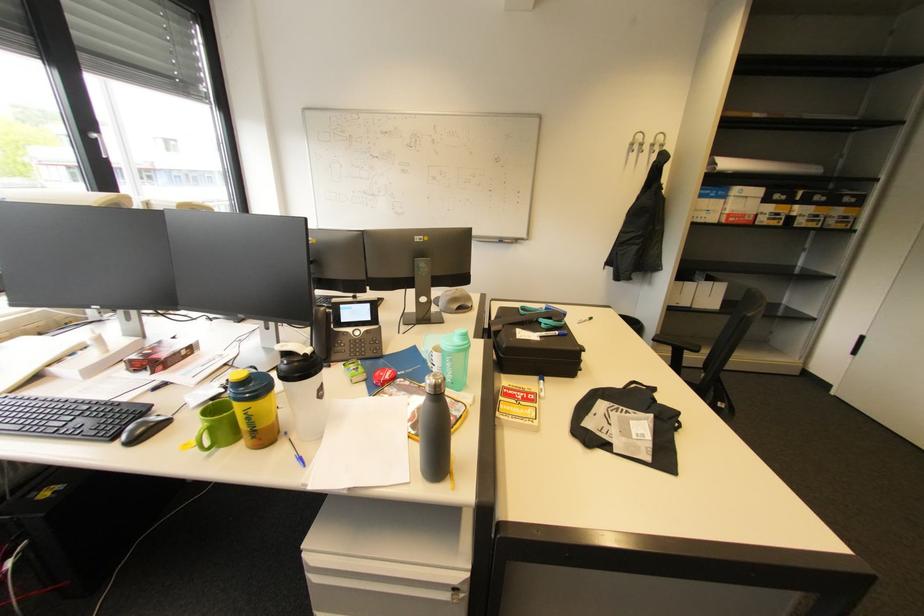
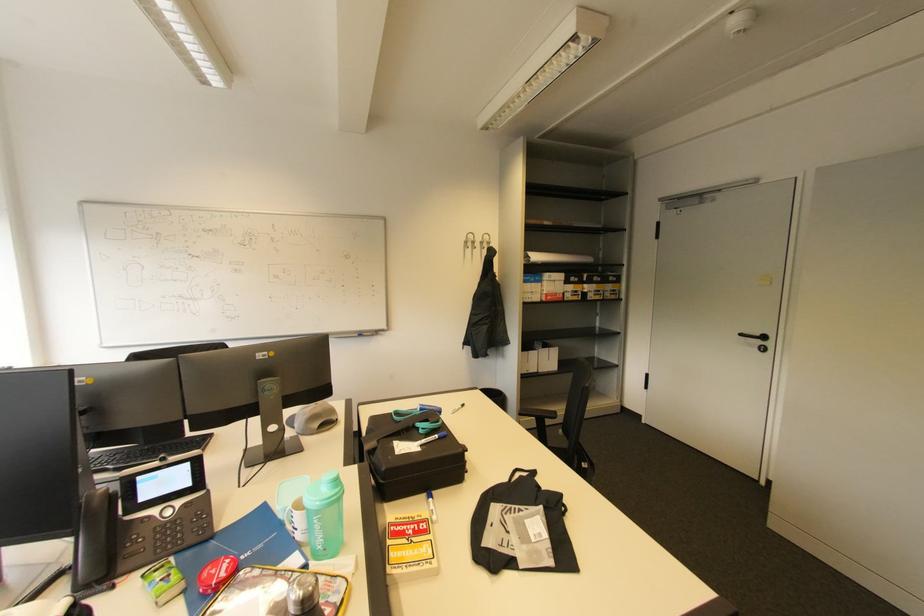
Find the pixel in the second image that matches pixel 459 307 in the first image.

(321, 426)